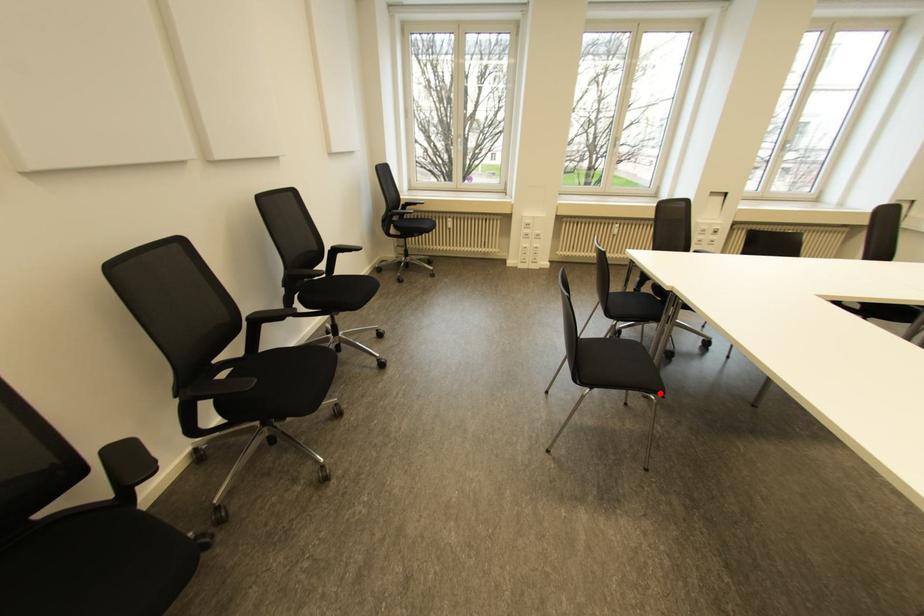
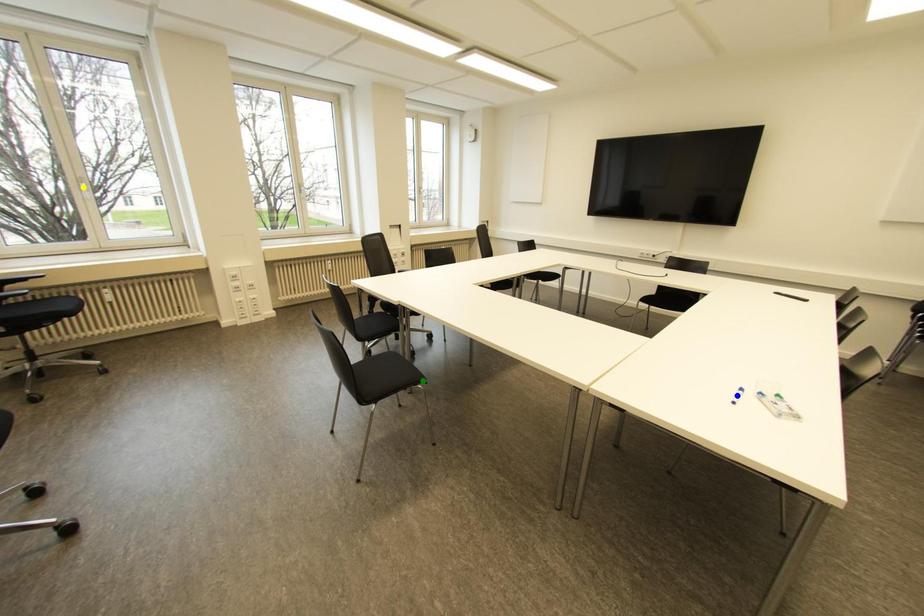
Question: I am providing you with two images of the same scene from different viewpoints. A red point is marked on the first image. You are given multiple points on the second image. Which point in image 2 is actually the same real-world point as the red point in image 1?

Choices:
 (A) green point
 (B) blue point
 (C) yellow point

Answer: (A)